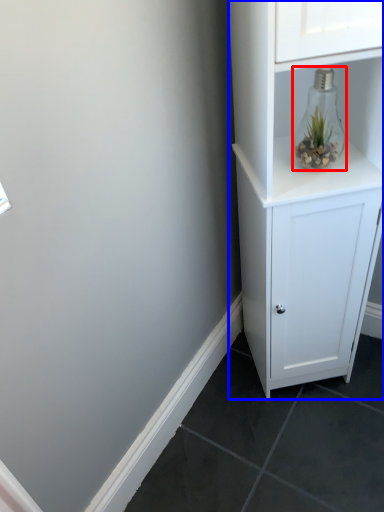
Question: Which object appears farthest to the camera in this image, glass vase (highlighted by a red box) or cupboard (highlighted by a blue box)?

Choices:
 (A) glass vase
 (B) cupboard

Answer: (A)